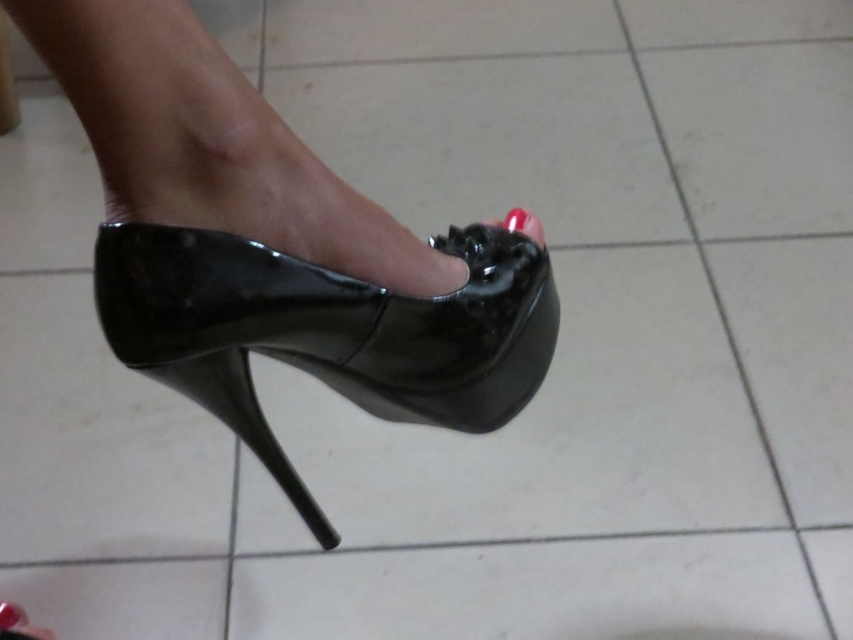
Who is positioned more to the left, glossy black high-heeled shoe at center or glossy nail polish at center?

Positioned to the left is glossy black high-heeled shoe at center.

I want to click on glossy black high-heeled shoe at center, so click(x=328, y=332).

This screenshot has height=640, width=853. What are the coordinates of `glossy black high-heeled shoe at center` in the screenshot? It's located at (328, 332).